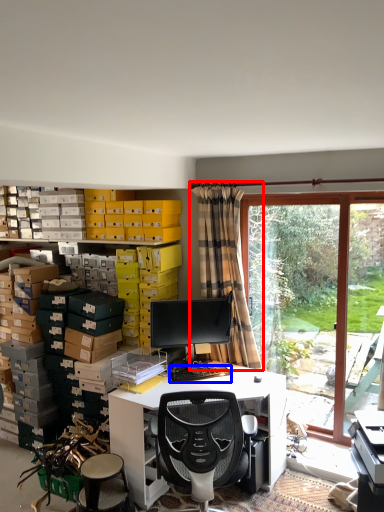
Question: Which point is closer to the camera, curtain (highlighted by a red box) or computer keyboard (highlighted by a blue box)?

Choices:
 (A) curtain
 (B) computer keyboard

Answer: (B)